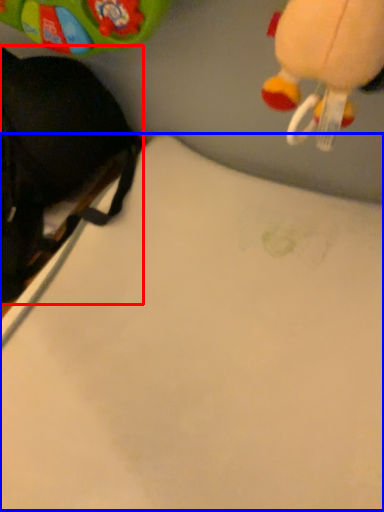
Question: Which point is closer to the camera, toy (highlighted by a red box) or sheet (highlighted by a blue box)?

Choices:
 (A) toy
 (B) sheet

Answer: (B)